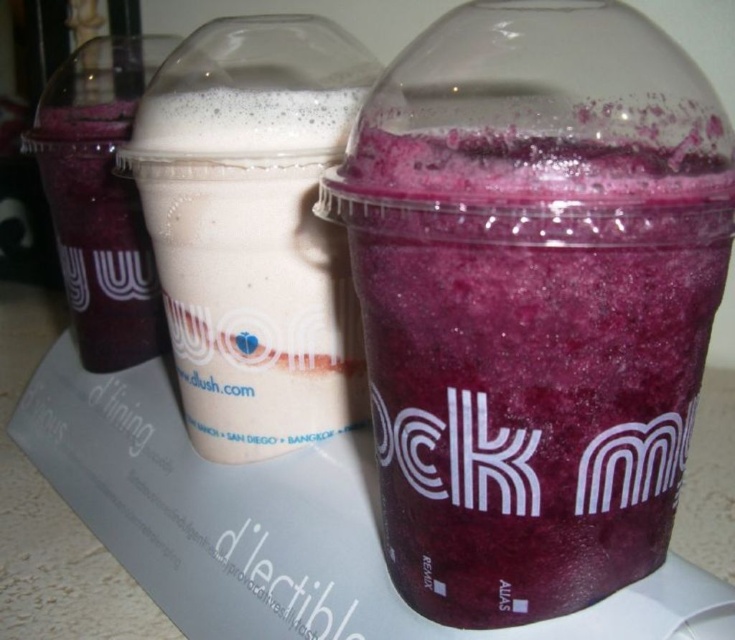
You are standing at the point marked as point (404, 212) and want to reach the middle cup. The distance between you and the middle cup is 16.13 inches. Can you grab it without moving your hand?

Yes, you can grab the middle cup without moving your hand because the distance between you and the middle cup is 16.13 inches, which is within reach.

You are standing in front of the three cups on the countertop. The purple matte smoothie at right is your favorite drink. To reach it, you need to move past the other cups. Which direction should you move relative to the middle cup to grab your favorite smoothie?

The purple matte smoothie at right is located to the right of the middle cup. Move to the right side of the middle cup to grab it.